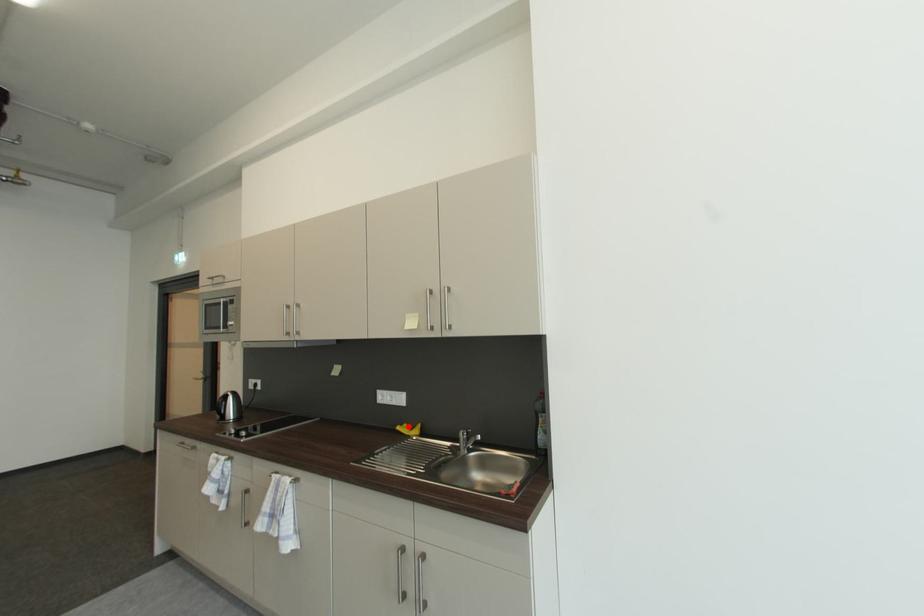
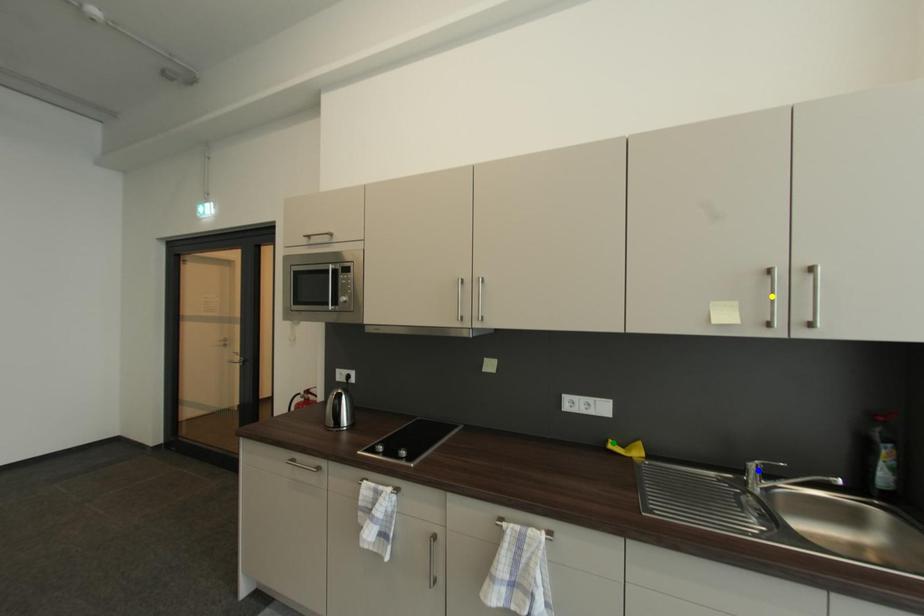
Question: I am providing you with two images of the same scene from different viewpoints. A red point is marked on the first image. You are given multiple points on the second image. Which mark in image 2 goes with the point in image 1?

Choices:
 (A) blue point
 (B) green point
 (C) yellow point

Answer: (B)